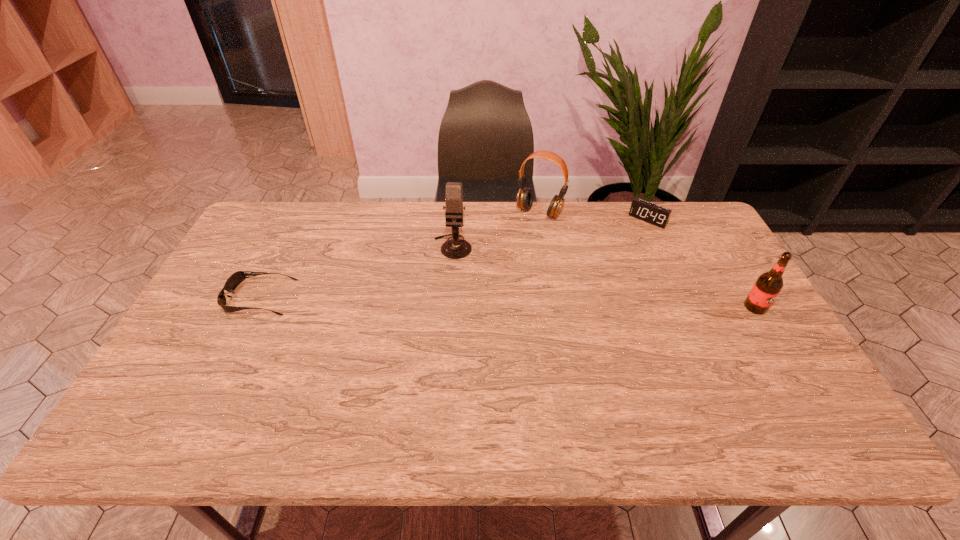
Image resolution: width=960 pixels, height=540 pixels. I want to click on object that can be found as the fourth closest to the microphone, so click(x=768, y=285).